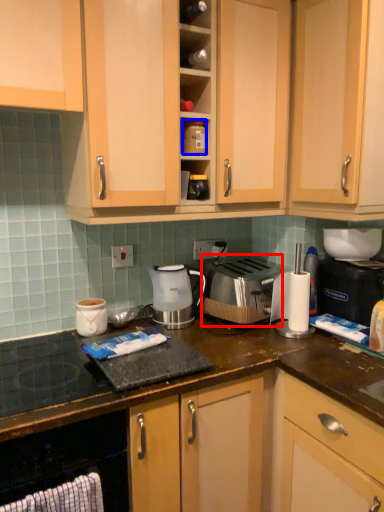
Question: Among these objects, which one is farthest to the camera, toaster (highlighted by a red box) or appliance (highlighted by a blue box)?

Choices:
 (A) toaster
 (B) appliance

Answer: (A)